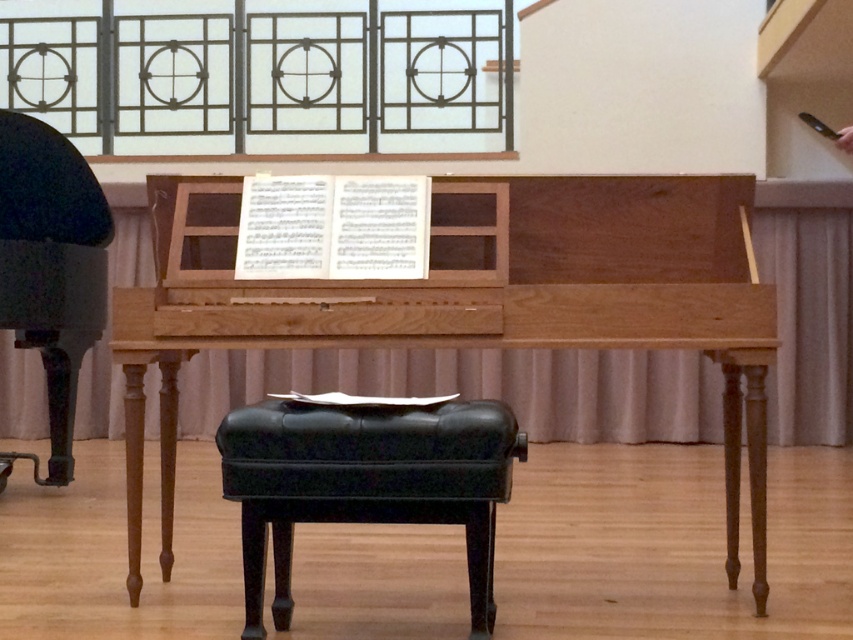
Question: Is natural wood piano at center behind black leather stool at center?

Choices:
 (A) no
 (B) yes

Answer: (B)

Question: Does natural wood piano at center appear on the right side of black leather stool at center?

Choices:
 (A) no
 (B) yes

Answer: (B)

Question: Does natural wood piano at center have a larger size compared to black leather stool at center?

Choices:
 (A) yes
 (B) no

Answer: (A)

Question: Which of the following is the closest to the observer?

Choices:
 (A) (166, 556)
 (B) (405, 513)

Answer: (B)

Question: Which point is farther from the camera taking this photo?

Choices:
 (A) (247, 451)
 (B) (350, 344)

Answer: (B)

Question: Which point appears farthest from the camera in this image?

Choices:
 (A) (512, 435)
 (B) (751, 180)

Answer: (B)